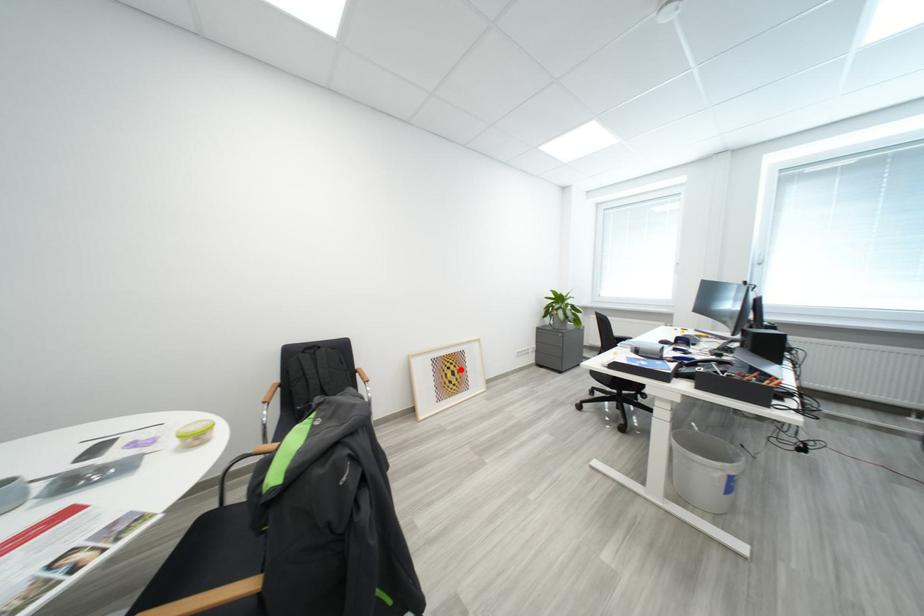
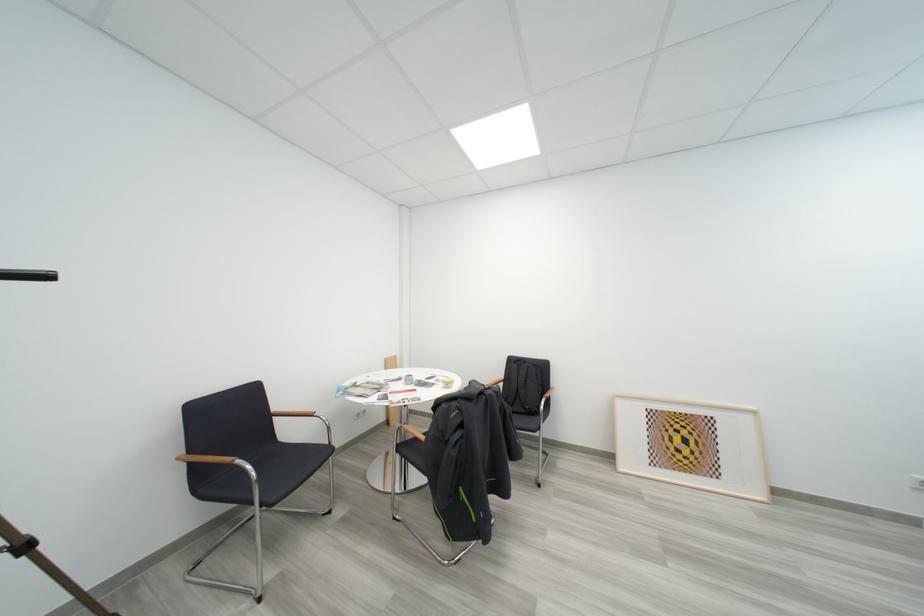
Question: I am providing you with two images of the same scene from different viewpoints. A red point is marked on the first image. Can you still see the location of the red point in image 2?

Choices:
 (A) Yes
 (B) No

Answer: (A)